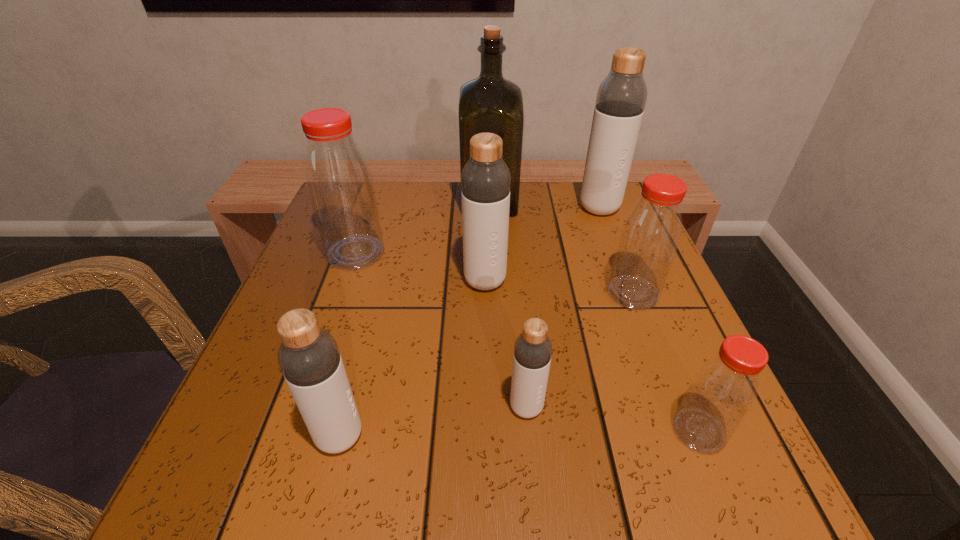
Where is `free space located on the label of the liquor`? free space located on the label of the liquor is located at coordinates (419, 201).

What are the coordinates of `free region located on the label of the liquor` in the screenshot? It's located at tap(438, 201).

Locate an element on the screen. free location located 0.270m on the label of the liquor is located at coordinates (354, 201).

You are a GUI agent. You are given a task and a screenshot of the screen. Output one action in this format:
    pyautogui.click(x=<x>, y=<y>)
    Task: Click on the free space located 0.100m on the front of the farthest gray bottle
    
    Given the screenshot: What is the action you would take?
    click(613, 245)

Locate an element on the screen. The image size is (960, 540). vacant region located 0.180m on the back of the leftmost red bottle is located at coordinates (376, 195).

Locate an element on the screen. vacant space located 0.110m on the right of the third smallest gray bottle is located at coordinates (561, 281).

This screenshot has width=960, height=540. In order to click on vacant space located 0.240m on the left of the second smallest red bottle in this screenshot , I will do `click(483, 293)`.

Locate an element on the screen. The image size is (960, 540). free space located 0.300m on the back of the third biggest gray bottle is located at coordinates (380, 281).

Locate an element on the screen. vacant space located 0.350m on the back of the smallest gray bottle is located at coordinates (513, 254).

I want to click on vacant space located 0.290m on the left of the smallest red bottle, so (471, 431).